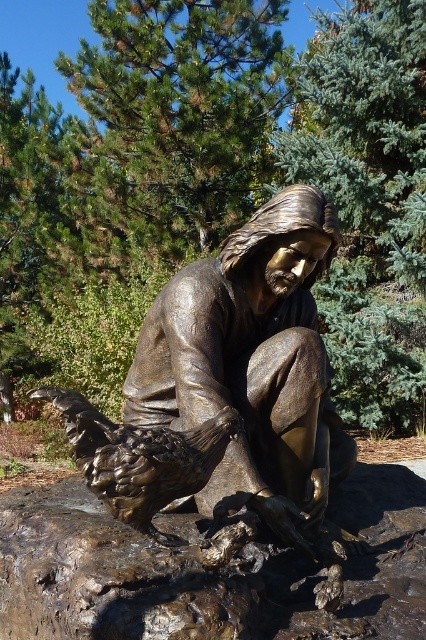
Can you confirm if rusty metallic rock at center is positioned to the left of bronze statue at center?

Yes, rusty metallic rock at center is to the left of bronze statue at center.

Is point (57, 593) behind point (337, 243)?

No, (57, 593) is closer to viewer.

At what (x,y) coordinates should I click in order to perform the action: click on rusty metallic rock at center. Please return your answer as a coordinate pair (x, y). The image size is (426, 640). Looking at the image, I should click on (207, 572).